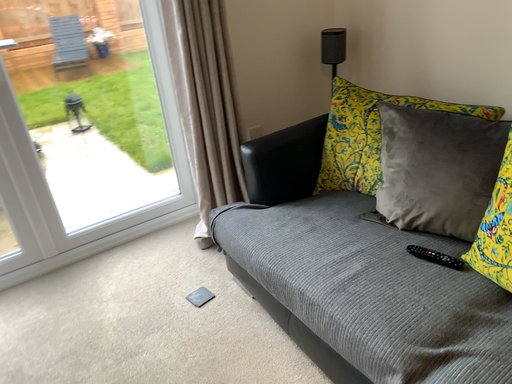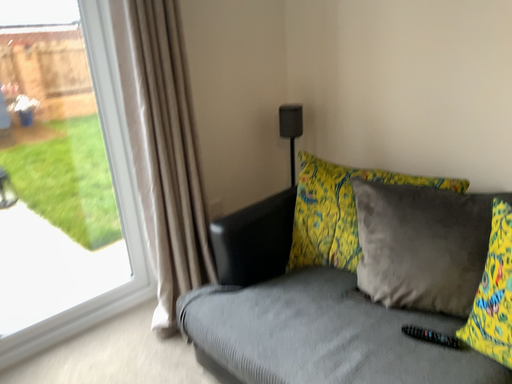
Question: How did the camera likely rotate when shooting the video?

Choices:
 (A) rotated upward
 (B) rotated downward

Answer: (A)